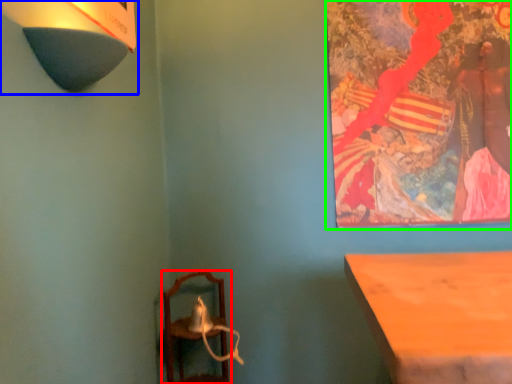
Question: Which is farther away from furniture (highlighted by a red box)? lamp (highlighted by a blue box) or picture frame (highlighted by a green box)?

Choices:
 (A) lamp
 (B) picture frame

Answer: (A)